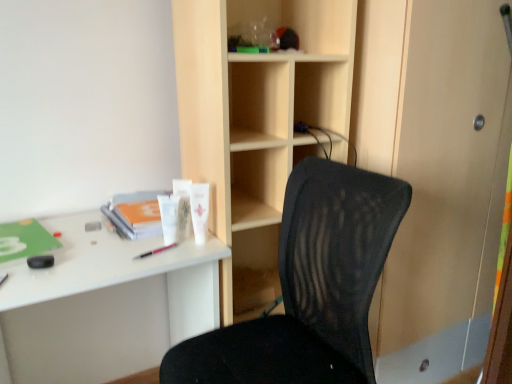
Question: Is black mesh chair at center surrounded by white plastic desk at left?

Choices:
 (A) no
 (B) yes

Answer: (A)

Question: From the image's perspective, is white plastic desk at left located beneath black mesh chair at center?

Choices:
 (A) yes
 (B) no

Answer: (A)

Question: Is white plastic desk at left outside of black mesh chair at center?

Choices:
 (A) yes
 (B) no

Answer: (A)

Question: Does white plastic desk at left have a greater height compared to black mesh chair at center?

Choices:
 (A) yes
 (B) no

Answer: (B)

Question: Is the surface of white plastic desk at left in direct contact with black mesh chair at center?

Choices:
 (A) no
 (B) yes

Answer: (A)

Question: Considering their positions, is black mesh chair at center located in front of or behind pink plastic pen at center, the second stationery in the top-to-bottom sequence?

Choices:
 (A) behind
 (B) front

Answer: (B)

Question: Choose the correct answer: Is black mesh chair at center inside pink plastic pen at center, the second stationery in the top-to-bottom sequence, or outside it?

Choices:
 (A) inside
 (B) outside

Answer: (B)

Question: Does point (307, 342) appear closer or farther from the camera than point (174, 243)?

Choices:
 (A) farther
 (B) closer

Answer: (B)

Question: Is black mesh chair at center bigger or smaller than pink plastic pen at center, acting as the 2th stationery starting from the right?

Choices:
 (A) small
 (B) big

Answer: (B)

Question: Considering the positions of pink plastic pen at center, which ranks as the first stationery in bottom-to-top order, and white matte lotion at center, the first stationery positioned from the right, in the image, is pink plastic pen at center, which ranks as the first stationery in bottom-to-top order, bigger or smaller than white matte lotion at center, the first stationery positioned from the right,?

Choices:
 (A) big
 (B) small

Answer: (B)

Question: In the image, is pink plastic pen at center, acting as the first stationery starting from the left, positioned in front of or behind white matte lotion at center, the first stationery positioned from the right?

Choices:
 (A) front
 (B) behind

Answer: (A)

Question: Which is correct: pink plastic pen at center, acting as the first stationery starting from the left, is inside white matte lotion at center, arranged as the 2th stationery when ordered from the bottom, or outside of it?

Choices:
 (A) outside
 (B) inside

Answer: (A)

Question: Is pink plastic pen at center, which ranks as the first stationery in bottom-to-top order, wider or thinner than white matte lotion at center, arranged as the 2th stationery when ordered from the bottom?

Choices:
 (A) wide
 (B) thin

Answer: (B)

Question: Is white plastic desk at left inside or outside of white matte lotion at center, the first stationery positioned from the right?

Choices:
 (A) inside
 (B) outside

Answer: (B)

Question: Considering the positions of white plastic desk at left and white matte lotion at center, arranged as the 2th stationery when ordered from the bottom, in the image, is white plastic desk at left wider or thinner than white matte lotion at center, arranged as the 2th stationery when ordered from the bottom,?

Choices:
 (A) wide
 (B) thin

Answer: (A)